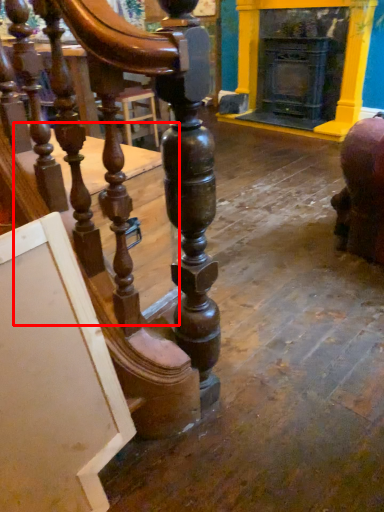
Question: From the image's perspective, what is the correct spatial positioning of table (annotated by the red box) in reference to fireplace?

Choices:
 (A) above
 (B) below

Answer: (B)